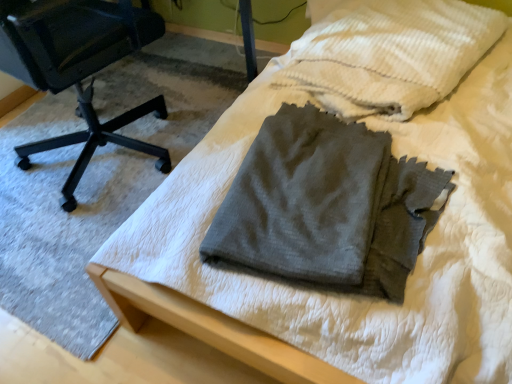
Question: Does dark gray cotton pants at center contain gray cotton towel at center?

Choices:
 (A) no
 (B) yes

Answer: (A)

Question: Is dark gray cotton pants at center positioned with its back to gray cotton towel at center?

Choices:
 (A) yes
 (B) no

Answer: (B)

Question: Is the surface of dark gray cotton pants at center in direct contact with gray cotton towel at center?

Choices:
 (A) yes
 (B) no

Answer: (B)

Question: From a real-world perspective, is dark gray cotton pants at center under gray cotton towel at center?

Choices:
 (A) yes
 (B) no

Answer: (A)

Question: Is dark gray cotton pants at center to the left of gray cotton towel at center from the viewer's perspective?

Choices:
 (A) no
 (B) yes

Answer: (B)

Question: From the image's perspective, is dark gray cotton pants at center above or below black plastic chair at left?

Choices:
 (A) above
 (B) below

Answer: (B)

Question: Visually, is dark gray cotton pants at center positioned to the left or to the right of black plastic chair at left?

Choices:
 (A) right
 (B) left

Answer: (A)

Question: Choose the correct answer: Is dark gray cotton pants at center inside black plastic chair at left or outside it?

Choices:
 (A) inside
 (B) outside

Answer: (B)

Question: Is point (415, 215) positioned closer to the camera than point (2, 61)?

Choices:
 (A) farther
 (B) closer

Answer: (B)

Question: Choose the correct answer: Is gray cotton towel at center inside black plastic chair at left or outside it?

Choices:
 (A) inside
 (B) outside

Answer: (B)

Question: Considering the positions of gray cotton towel at center and black plastic chair at left in the image, is gray cotton towel at center wider or thinner than black plastic chair at left?

Choices:
 (A) thin
 (B) wide

Answer: (A)

Question: Considering the relative positions of gray cotton towel at center and black plastic chair at left in the image provided, is gray cotton towel at center to the left or to the right of black plastic chair at left?

Choices:
 (A) right
 (B) left

Answer: (A)

Question: From a real-world perspective, is gray cotton towel at center above or below black plastic chair at left?

Choices:
 (A) below
 (B) above

Answer: (B)

Question: Considering their positions, is black plastic chair at left located in front of or behind gray cotton towel at center?

Choices:
 (A) front
 (B) behind

Answer: (A)

Question: Considering the positions of black plastic chair at left and gray cotton towel at center in the image, is black plastic chair at left taller or shorter than gray cotton towel at center?

Choices:
 (A) short
 (B) tall

Answer: (B)